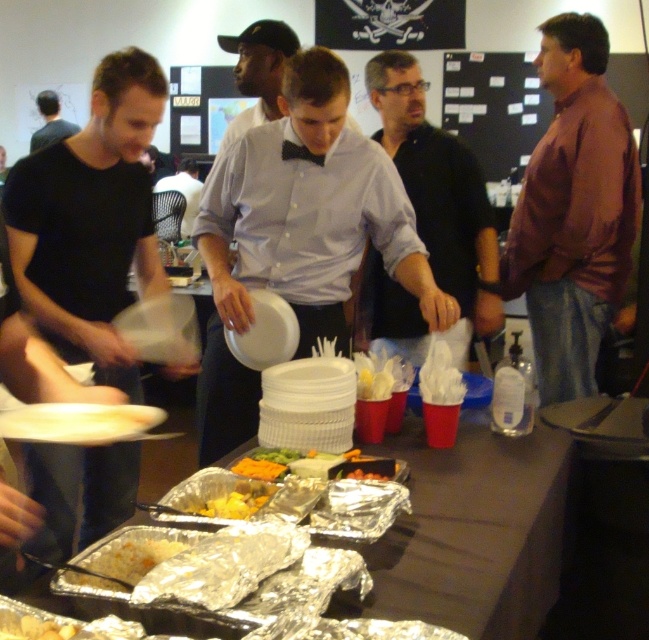
You are a guest at the event and want to take a photo of the black matte shirt at center and the orange matte food at center. Which one should you zoom in on more to ensure both are clearly visible in the photo?

The black matte shirt at center is bigger than the orange matte food at center, so you should zoom in more on the orange matte food at center to ensure both are clearly visible in the photo.

You are a guest at this event and want to know if you can reach the yellow crumbly cheese at lower left from where you are standing near the dark brown hair at upper left without moving more than 20 feet. Can you do it?

The yellow crumbly cheese at lower left is 20.47 feet from dark brown hair at upper left, so you cannot reach it without moving more than 20 feet since the distance is slightly over.